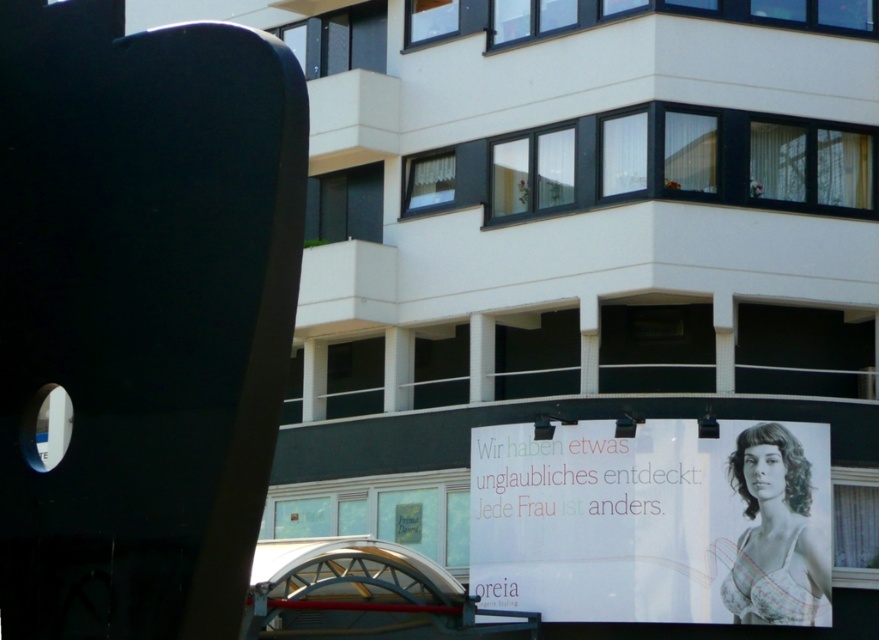
You are standing at the base of the building and want to read the text on the white paper poster at lower right. Can you read it clearly from your current position?

The white paper poster at lower right is 45.25 meters away from the viewer, so it is too far to read the text clearly from that distance.

You are a delivery person trying to read the text on the white paper poster at lower right. The matte black bra at center is blocking your view. Can you move the bra to see the poster?

The white paper poster at lower right is located below the matte black bra at center, so moving the bra upwards would allow you to see the poster.